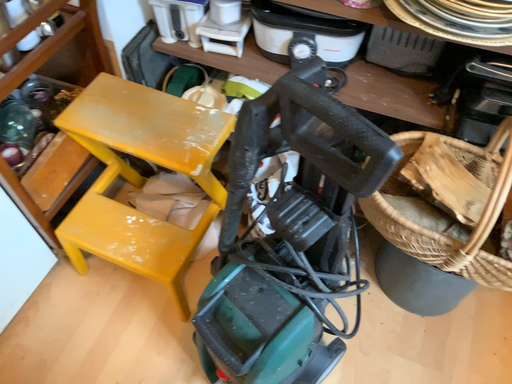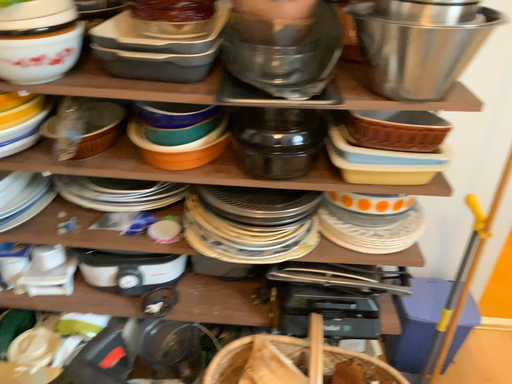
Question: Which way did the camera rotate in the video?

Choices:
 (A) rotated upward
 (B) rotated downward

Answer: (A)